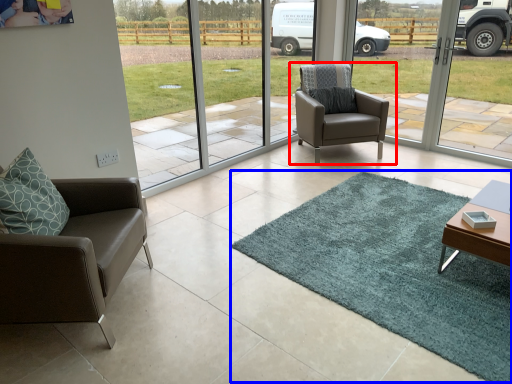
Question: Among these objects, which one is farthest to the camera, chair (highlighted by a red box) or mat (highlighted by a blue box)?

Choices:
 (A) chair
 (B) mat

Answer: (A)